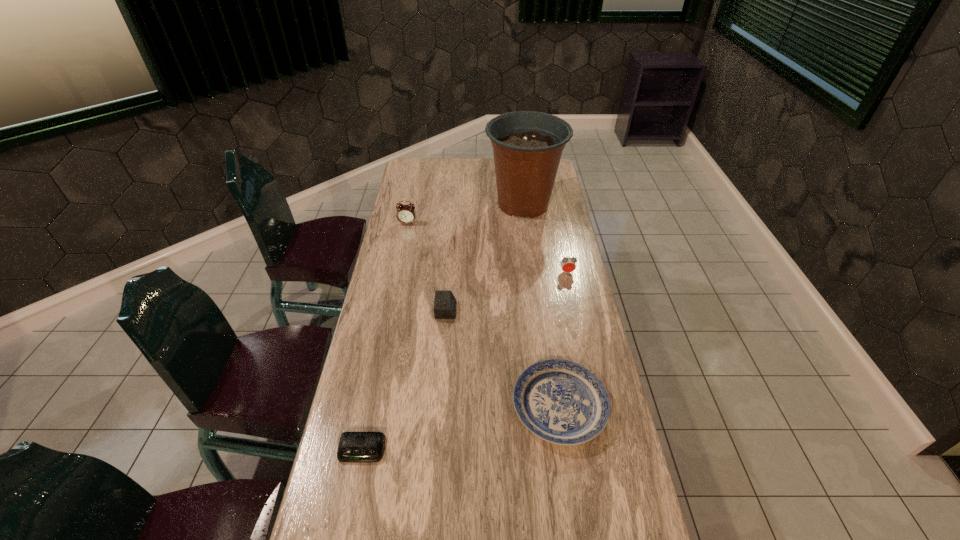
The height and width of the screenshot is (540, 960). I want to click on free space at the left edge of the desktop, so coord(419,284).

Locate an element on the screen. This screenshot has width=960, height=540. blank space at the right edge is located at coordinates (540, 242).

Where is `empty space between the flowerpot and the second shortest object`? This screenshot has height=540, width=960. empty space between the flowerpot and the second shortest object is located at coordinates (541, 305).

Where is `free area in between the third alarm clock from left to right and the second tallest object`? free area in between the third alarm clock from left to right and the second tallest object is located at coordinates (427, 267).

Identify the location of free space between the nearest alarm clock and the plate. (461, 428).

The width and height of the screenshot is (960, 540). Find the location of `empty location between the fifth shortest object and the third shortest object`. empty location between the fifth shortest object and the third shortest object is located at coordinates (427, 267).

This screenshot has width=960, height=540. What are the coordinates of `empty location between the nearest alarm clock and the flowerpot` in the screenshot? It's located at (443, 327).

At what (x,y) coordinates should I click in order to perform the action: click on free space between the fifth tallest object and the third nearest object. Please return your answer as a coordinate pair (x, y). Looking at the image, I should click on (503, 358).

Locate an element on the screen. The image size is (960, 540). empty location between the third nearest object and the nearest alarm clock is located at coordinates (404, 380).

The image size is (960, 540). Find the location of `free space that is in between the fourth shortest object and the shortest alarm clock`. free space that is in between the fourth shortest object and the shortest alarm clock is located at coordinates [465, 361].